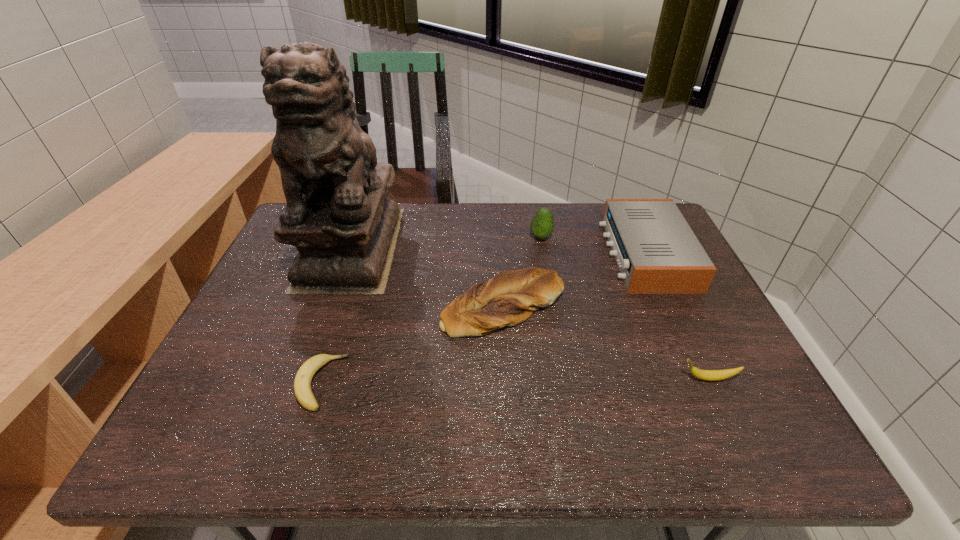
Locate an element on the screen. The image size is (960, 540). vacant space situated on the control panel of the radio receiver is located at coordinates (566, 254).

The height and width of the screenshot is (540, 960). I want to click on vacant area situated on the control panel of the radio receiver, so click(x=521, y=254).

Image resolution: width=960 pixels, height=540 pixels. I want to click on vacant area located 0.250m on the control panel of the radio receiver, so click(521, 254).

You are a GUI agent. You are given a task and a screenshot of the screen. Output one action in this format:
    pyautogui.click(x=<x>, y=<y>)
    Task: Click on the free space located on the left of the bread
    This screenshot has width=960, height=540.
    Given the screenshot: What is the action you would take?
    pyautogui.click(x=398, y=307)

At what (x,y) coordinates should I click in order to perform the action: click on free space located at the stem of the taller banana. Please return your answer as a coordinate pair (x, y). This screenshot has width=960, height=540. Looking at the image, I should click on (540, 379).

Where is `vacant area situated at the stem of the taller banana`? The image size is (960, 540). vacant area situated at the stem of the taller banana is located at coordinates (512, 379).

The width and height of the screenshot is (960, 540). Find the location of `free space located 0.130m at the stem of the taller banana`. free space located 0.130m at the stem of the taller banana is located at coordinates (618, 379).

The image size is (960, 540). I want to click on free region located on the right of the shortest object, so click(x=483, y=383).

I want to click on sculpture that is at the far edge, so 338,215.

The image size is (960, 540). What are the coordinates of `avocado at the far edge` in the screenshot? It's located at (542, 224).